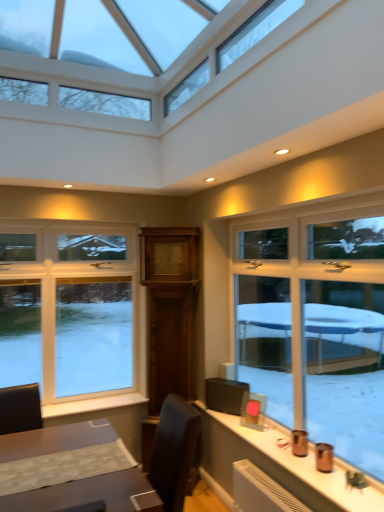
Identify the location of vacant space situated above white painted wood at lower left (from a real-world perspective). (110, 400).